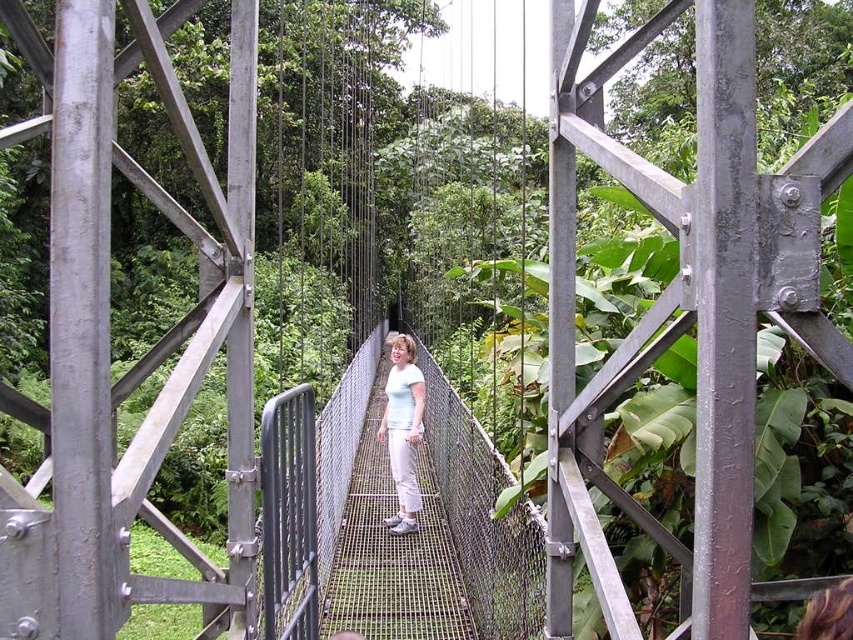
Question: Does metal mesh rope bridge at center come in front of white matte pants at center?

Choices:
 (A) no
 (B) yes

Answer: (B)

Question: Among these objects, which one is nearest to the camera?

Choices:
 (A) metal mesh rope bridge at center
 (B) white matte pants at center

Answer: (A)

Question: Can you confirm if metal mesh rope bridge at center is positioned to the right of white matte pants at center?

Choices:
 (A) yes
 (B) no

Answer: (B)

Question: Considering the relative positions of metal mesh rope bridge at center and white matte pants at center in the image provided, where is metal mesh rope bridge at center located with respect to white matte pants at center?

Choices:
 (A) left
 (B) right

Answer: (A)